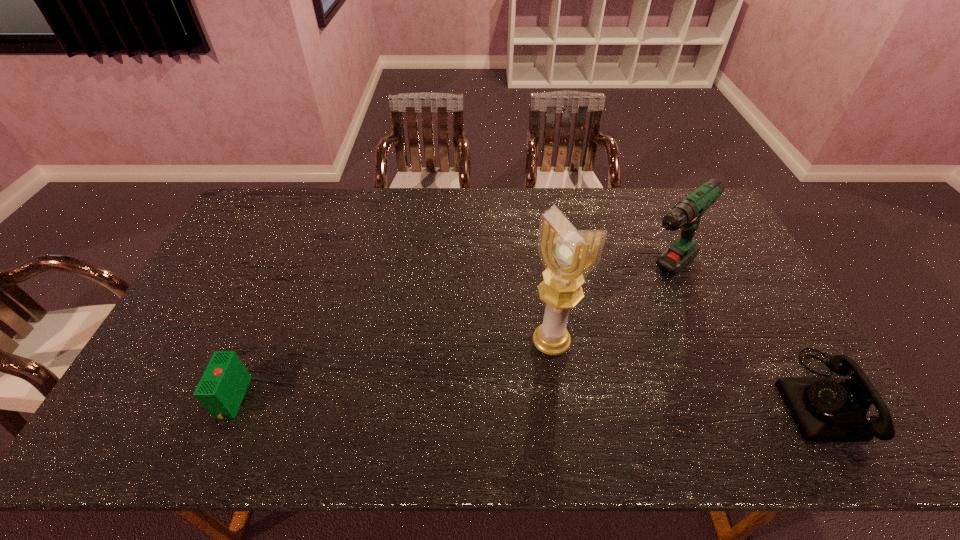
Find the location of a particular element. vacant space located 0.380m on the front face of the telephone is located at coordinates (627, 397).

I want to click on free location located 0.160m on the front face of the telephone, so click(716, 397).

The image size is (960, 540). Find the location of `vacant space located 0.400m on the handle side of the third shortest object`. vacant space located 0.400m on the handle side of the third shortest object is located at coordinates (549, 370).

Locate an element on the screen. This screenshot has width=960, height=540. free space located on the handle side of the third shortest object is located at coordinates (564, 357).

At what (x,y) coordinates should I click in order to perform the action: click on free spot located 0.140m on the handle side of the third shortest object. Please return your answer as a coordinate pair (x, y). Looking at the image, I should click on (610, 317).

This screenshot has width=960, height=540. Find the location of `blank space located on the front-facing side of the third object from right to left`. blank space located on the front-facing side of the third object from right to left is located at coordinates (495, 401).

This screenshot has height=540, width=960. What are the coordinates of `vacant space located 0.090m on the front-facing side of the third object from right to left` in the screenshot? It's located at (516, 379).

I want to click on blank area located on the front-facing side of the third object from right to left, so click(x=492, y=403).

Find the location of `alarm clock that is at the near edge`. alarm clock that is at the near edge is located at coordinates (221, 389).

Identify the location of telephone at the near edge. The image size is (960, 540). (825, 409).